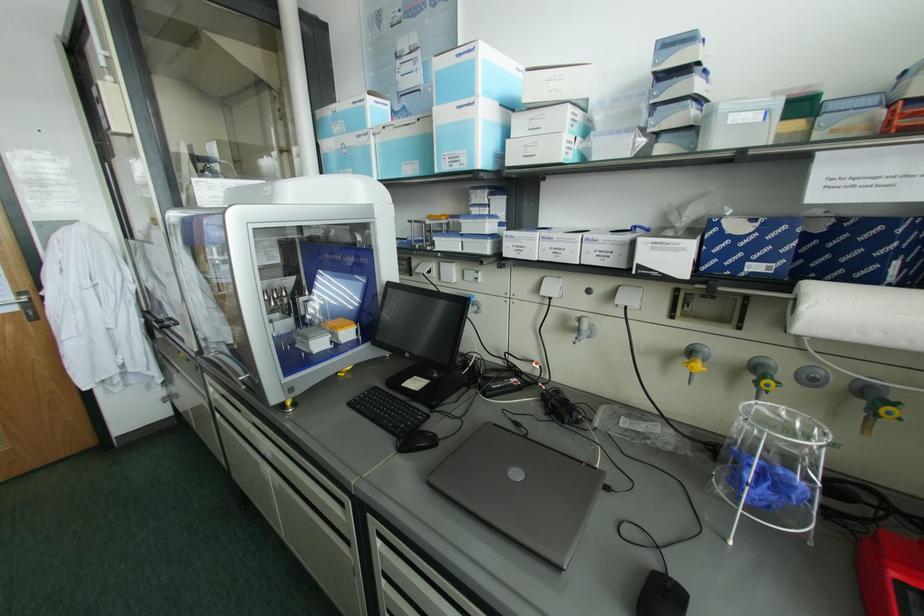
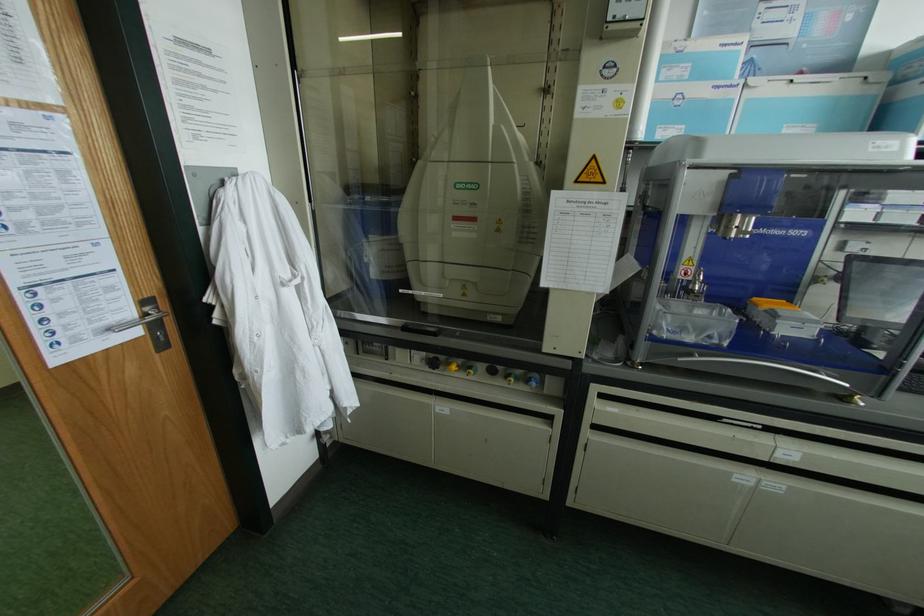
Question: In a continuous first-person perspective shot, in which direction is the camera moving?

Choices:
 (A) Left
 (B) Right
 (C) Forward
 (D) Backward

Answer: (A)